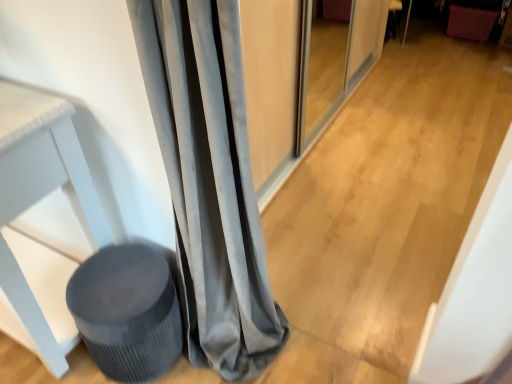
The height and width of the screenshot is (384, 512). What are the coordinates of `free point to the left of velvet burgundy swivel chair at upper right` in the screenshot? It's located at (428, 37).